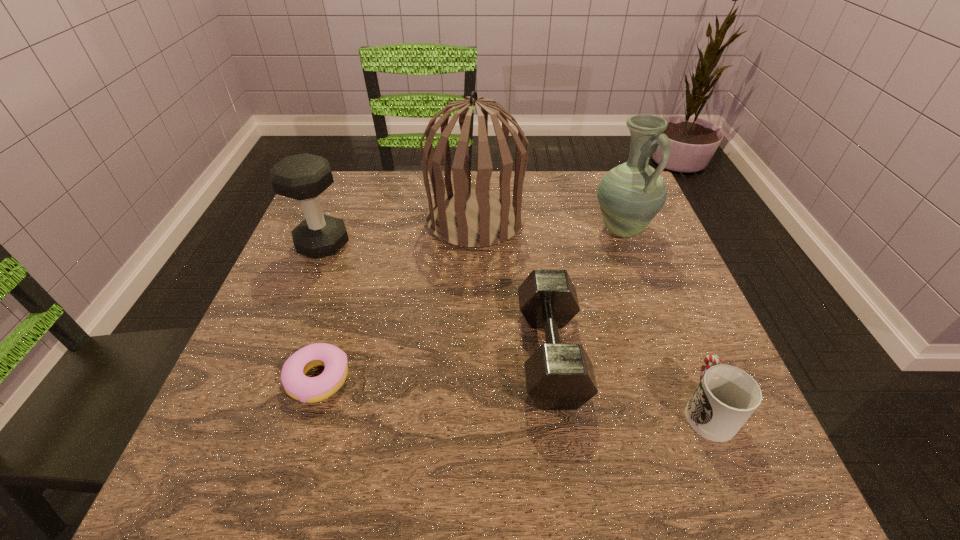
Where is `birdcage`? birdcage is located at coordinates (473, 218).

The height and width of the screenshot is (540, 960). I want to click on pitcher, so click(x=630, y=195).

Identify the location of the taller dumbbell. This screenshot has height=540, width=960. (303, 177).

This screenshot has height=540, width=960. I want to click on the farther dumbbell, so click(x=303, y=177).

Image resolution: width=960 pixels, height=540 pixels. Find the location of `the right dumbbell`. the right dumbbell is located at coordinates (559, 376).

Where is `the nearer dumbbell`? the nearer dumbbell is located at coordinates (559, 376).

The width and height of the screenshot is (960, 540). Identify the location of cup. (726, 397).

Identify the location of the shortest object. (306, 389).

The image size is (960, 540). Identify the location of free space located 0.170m on the front of the birdcage. (474, 306).

I want to click on vacant space located 0.120m on the handle side of the pitcher, so click(x=642, y=285).